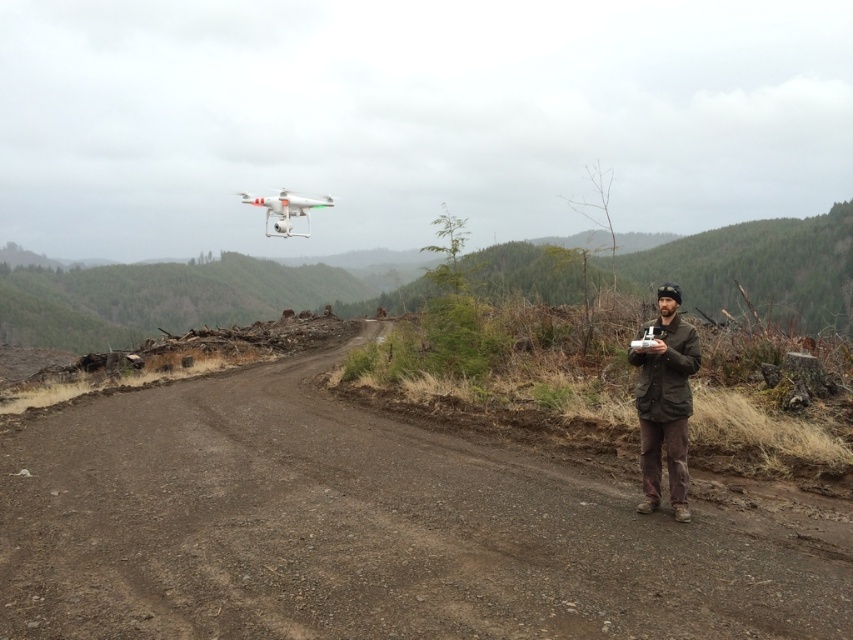
Question: Can you confirm if brown dirt track at center is bigger than white matte drone at upper center?

Choices:
 (A) no
 (B) yes

Answer: (A)

Question: Which object is the closest to the brown dirt track at center?

Choices:
 (A) white matte drone at upper center
 (B) brown woolen jacket at right

Answer: (B)

Question: Which of these objects is positioned closest to the white matte drone at upper center?

Choices:
 (A) brown dirt track at center
 (B) brown woolen jacket at right

Answer: (A)

Question: Does brown dirt track at center appear over white matte drone at upper center?

Choices:
 (A) no
 (B) yes

Answer: (A)

Question: Does brown dirt track at center appear over white matte drone at upper center?

Choices:
 (A) yes
 (B) no

Answer: (B)

Question: Based on their relative distances, which object is nearer to the brown woolen jacket at right?

Choices:
 (A) brown dirt track at center
 (B) white matte drone at upper center

Answer: (A)